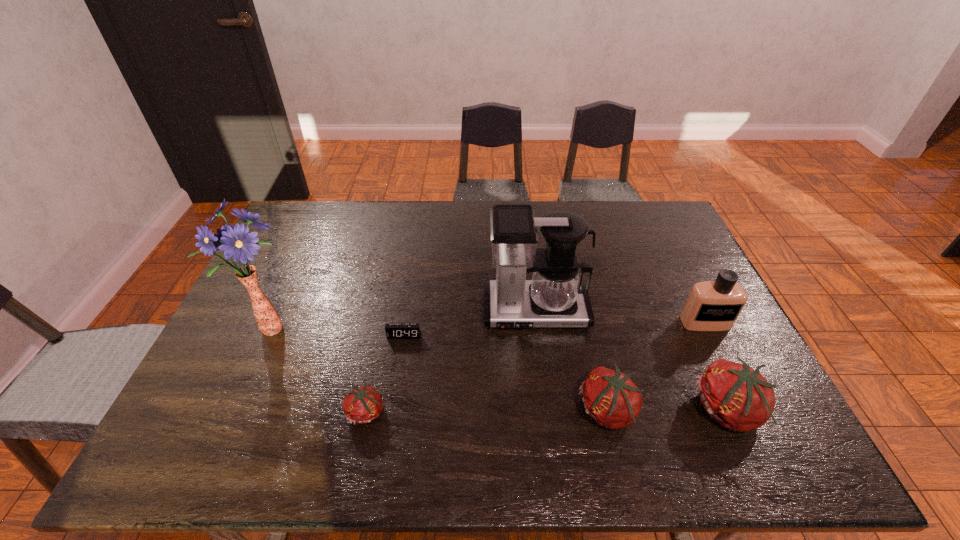
The height and width of the screenshot is (540, 960). I want to click on object that is at the near right corner, so click(x=738, y=397).

At what (x,y) coordinates should I click in order to perform the action: click on vacant space at the far edge. Please return your answer as a coordinate pair (x, y). The height and width of the screenshot is (540, 960). Looking at the image, I should click on (598, 203).

In the image, there is a desktop. At what (x,y) coordinates should I click in order to perform the action: click on vacant area at the near edge. Please return your answer as a coordinate pair (x, y). The width and height of the screenshot is (960, 540). Looking at the image, I should click on (343, 397).

You are a GUI agent. You are given a task and a screenshot of the screen. Output one action in this format:
    pyautogui.click(x=<x>, y=<y>)
    Task: Click on the free location at the left edge of the desktop
    This screenshot has width=960, height=540.
    Given the screenshot: What is the action you would take?
    pyautogui.click(x=282, y=289)

What are the coordinates of `vacant space at the right edge` in the screenshot? It's located at (649, 248).

Identify the location of free space at the far left corner. This screenshot has width=960, height=540. coord(299,241).

Locate an element on the screen. The height and width of the screenshot is (540, 960). blank space at the far right corner of the desktop is located at coordinates (659, 227).

Image resolution: width=960 pixels, height=540 pixels. In order to click on free point between the shortest tomato and the fifth shortest object in this screenshot , I will do `click(536, 367)`.

Image resolution: width=960 pixels, height=540 pixels. Identify the location of free spot between the rightmost tomato and the shortest object. (565, 373).

You are a GUI agent. You are given a task and a screenshot of the screen. Output one action in this format:
    pyautogui.click(x=<x>, y=<y>)
    Task: Click on the free area in between the sixth shortest object and the alarm clock
    
    Given the screenshot: What is the action you would take?
    pyautogui.click(x=469, y=323)